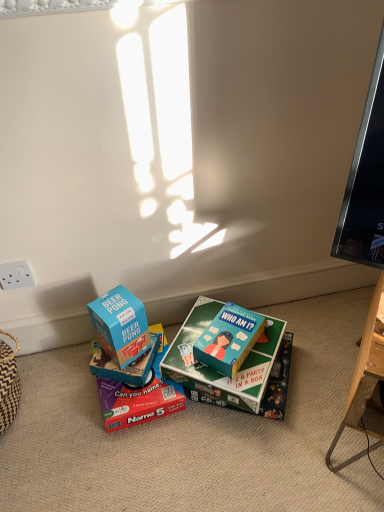
Locate an element on the screen. The height and width of the screenshot is (512, 384). empty space that is ontop of teal matte board game at center, arranged as the 4th box when viewed from the left (from a real-world perspective) is located at coordinates (205, 359).